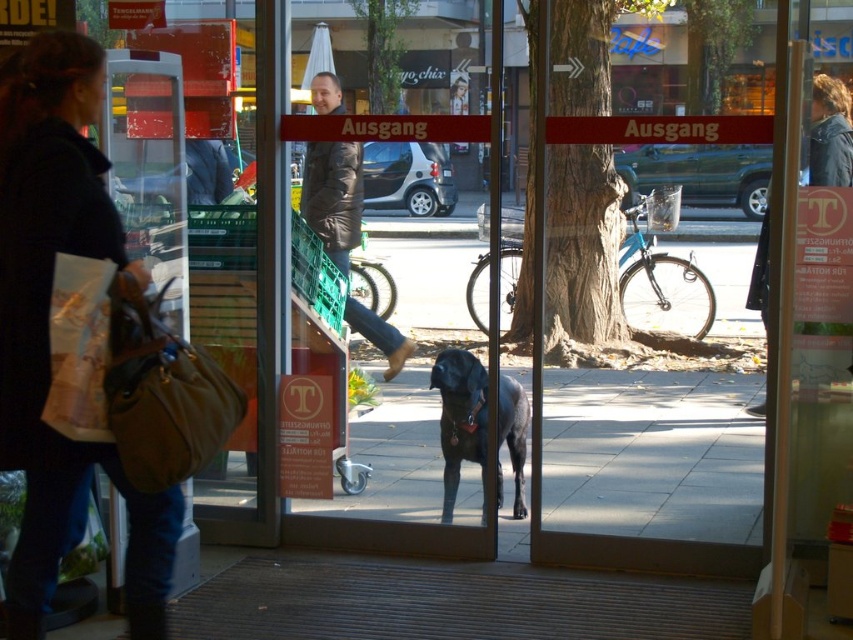
Question: Which object appears closest to the camera in this image?

Choices:
 (A) dark brown leather jacket at upper right
 (B) dark blue jeans at lower left

Answer: (B)

Question: Which object appears farthest from the camera in this image?

Choices:
 (A) brown leather jacket at center
 (B) shiny black dog at center
 (C) dark brown leather jacket at upper right

Answer: (A)

Question: Can you confirm if brown leather jacket at center is wider than dark brown leather jacket at upper right?

Choices:
 (A) no
 (B) yes

Answer: (B)

Question: Among these objects, which one is farthest from the camera?

Choices:
 (A) shiny black dog at center
 (B) dark brown leather jacket at upper right
 (C) dark blue jeans at lower left

Answer: (A)

Question: Does brown leather jacket at center appear on the left side of shiny black dog at center?

Choices:
 (A) yes
 (B) no

Answer: (A)

Question: Can you confirm if brown leather jacket at center is positioned to the right of dark brown leather jacket at upper right?

Choices:
 (A) no
 (B) yes

Answer: (A)